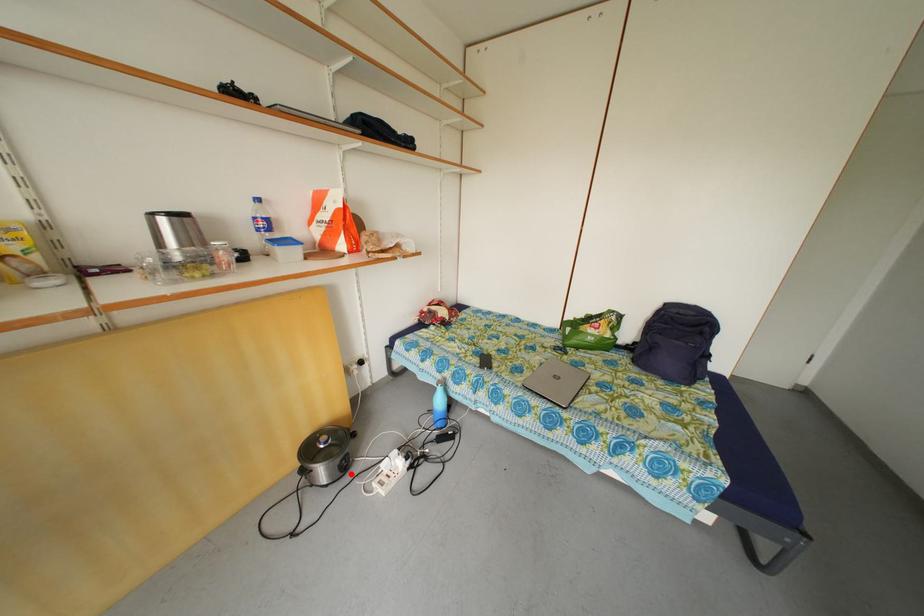
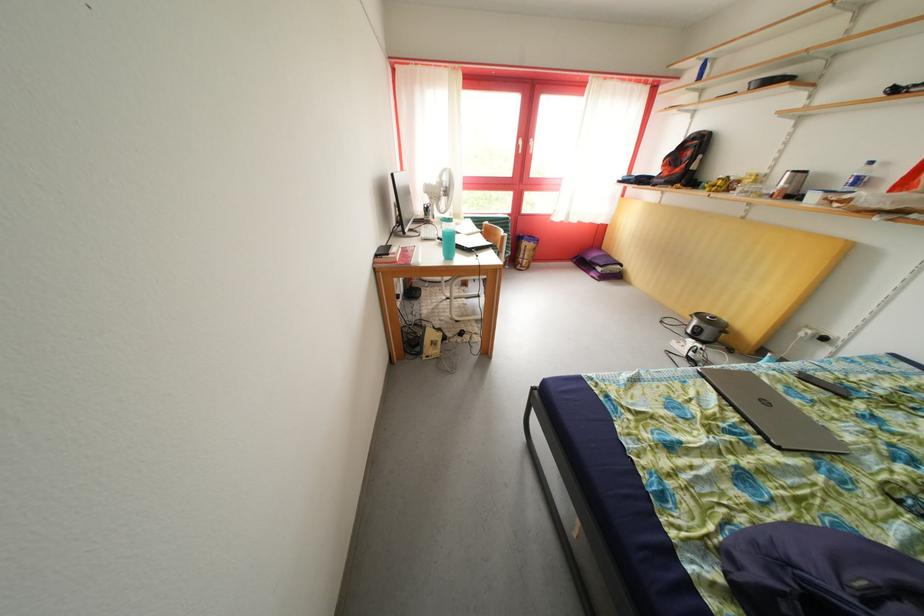
Where in the second image is the point corresponding to the highlighted location from the first image?

(702, 342)